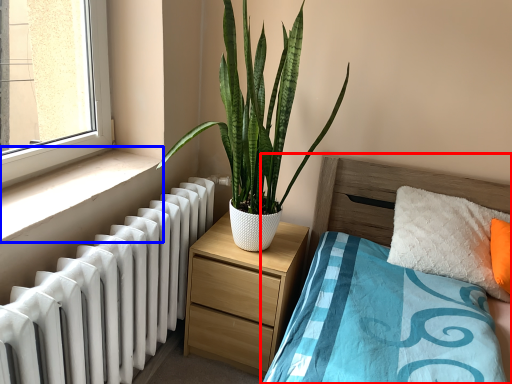
Question: Which object appears closest to the camera in this image, bed (highlighted by a red box) or window sill (highlighted by a blue box)?

Choices:
 (A) bed
 (B) window sill

Answer: (A)